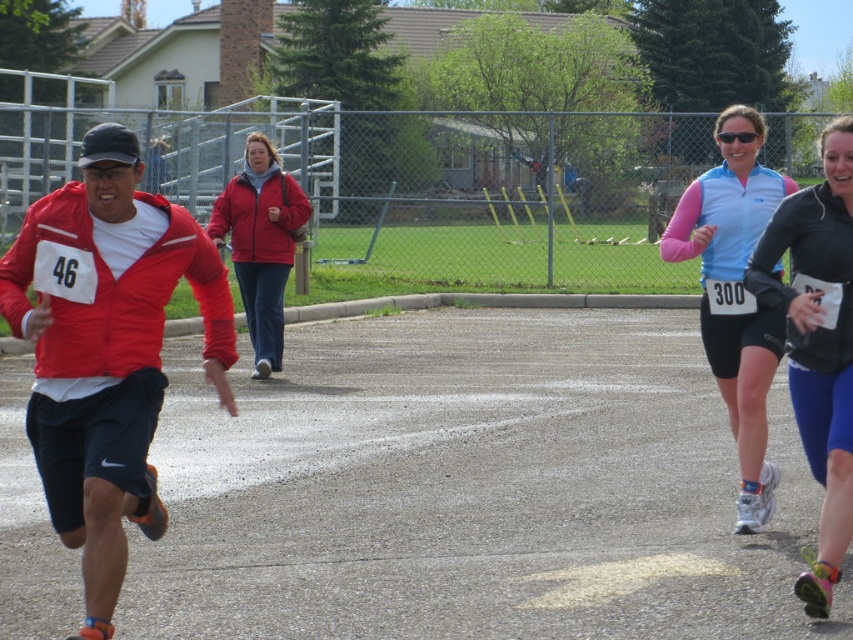
Is light blue synthetic vest at right positioned at the back of matte red jacket at center?

That is False.

Who is positioned more to the left, light blue synthetic vest at right or matte red jacket at center?

Positioned to the left is matte red jacket at center.

Between point (752, 172) and point (279, 330), which one is positioned behind?

Point (279, 330)

Locate an element on the screen. The width and height of the screenshot is (853, 640). light blue synthetic vest at right is located at coordinates (735, 296).

Is light blue synthetic vest at right taller than sunglasses at upper center?

Indeed, light blue synthetic vest at right has a greater height compared to sunglasses at upper center.

Is point (750, 216) more distant than point (747, 131)?

Yes, it is.

Locate an element on the screen. The width and height of the screenshot is (853, 640). light blue synthetic vest at right is located at coordinates (735, 296).

Can you confirm if matte red jacket at center is positioned to the left of sunglasses at upper center?

Indeed, matte red jacket at center is positioned on the left side of sunglasses at upper center.

Does matte red jacket at center appear on the right side of sunglasses at upper center?

In fact, matte red jacket at center is to the left of sunglasses at upper center.

The image size is (853, 640). What do you see at coordinates (260, 243) in the screenshot?
I see `matte red jacket at center` at bounding box center [260, 243].

I want to click on matte red jacket at center, so click(260, 243).